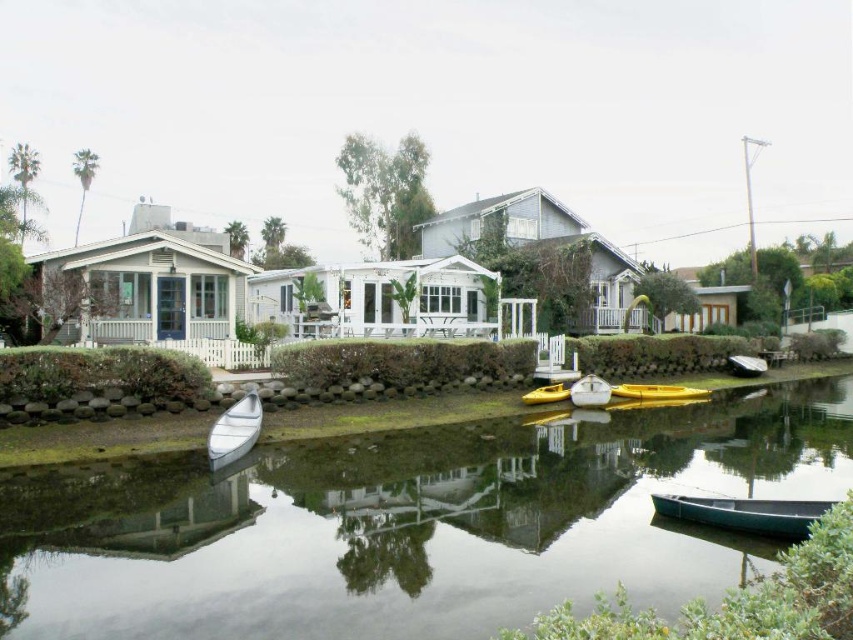
Based on the photo, can you confirm if white glossy boat at lower left is smaller than yellow matte kayak at center?

No.

Is white glossy boat at lower left shorter than yellow matte kayak at center?

Incorrect, white glossy boat at lower left's height does not fall short of yellow matte kayak at center's.

Where is `white glossy boat at lower left`? white glossy boat at lower left is located at coordinates (234, 429).

Locate an element on the screen. The image size is (853, 640). white glossy boat at lower left is located at coordinates (234, 429).

Can you confirm if green matte canoe at lower right is positioned to the left of white glossy boat at lower left?

In fact, green matte canoe at lower right is to the right of white glossy boat at lower left.

Which is more to the right, green matte canoe at lower right or white glossy boat at lower left?

green matte canoe at lower right is more to the right.

Find the location of a particular element. The image size is (853, 640). green matte canoe at lower right is located at coordinates point(744,513).

What do you see at coordinates (744, 513) in the screenshot?
I see `green matte canoe at lower right` at bounding box center [744, 513].

Looking at this image, between green matte canoe at lower right and yellow matte kayak at center, which one appears on the right side from the viewer's perspective?

green matte canoe at lower right

You are a GUI agent. You are given a task and a screenshot of the screen. Output one action in this format:
    pyautogui.click(x=<x>, y=<y>)
    Task: Click on the green matte canoe at lower right
    The width and height of the screenshot is (853, 640).
    Given the screenshot: What is the action you would take?
    pyautogui.click(x=744, y=513)